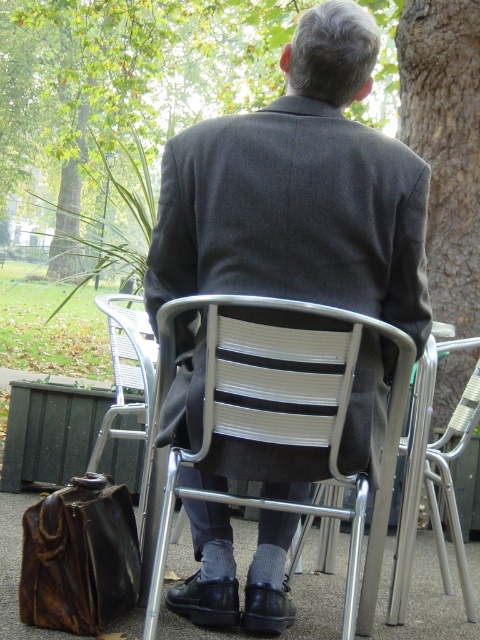
Question: Does smooth bark tree trunk at right appear under silver metallic chair at center?

Choices:
 (A) no
 (B) yes

Answer: (A)

Question: Which is farther from the leather briefcase at lower left?

Choices:
 (A) smooth bark tree trunk at right
 (B) dark gray wool jacket at center
 (C) silver metallic chair at center

Answer: (A)

Question: Which is farther from the metallic silver chair at center?

Choices:
 (A) leather briefcase at lower left
 (B) silver metallic chair at center

Answer: (B)

Question: Does metallic silver chair at center appear on the right side of smooth bark tree trunk at right?

Choices:
 (A) yes
 (B) no

Answer: (B)

Question: Which of these objects is positioned farthest from the silver metallic chair at center?

Choices:
 (A) smooth bark tree trunk at right
 (B) dark gray wool jacket at center

Answer: (A)

Question: Is metallic silver chair at center to the right of leather briefcase at lower left from the viewer's perspective?

Choices:
 (A) yes
 (B) no

Answer: (A)